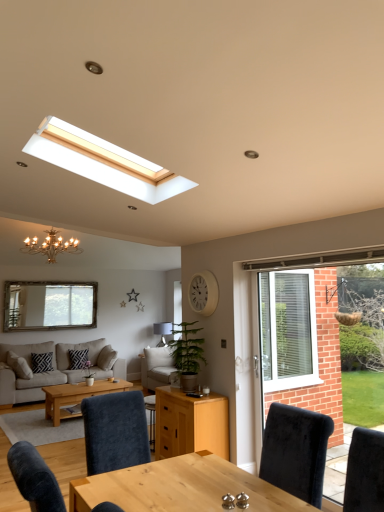
Question: From the image's perspective, is black textured pillow at center, the second pillow viewed from the left, beneath beige fabric couch at lower left?

Choices:
 (A) yes
 (B) no

Answer: (B)

Question: Would you consider black textured pillow at center, the second pillow viewed from the left, to be distant from beige fabric couch at lower left?

Choices:
 (A) yes
 (B) no

Answer: (B)

Question: Can you confirm if black textured pillow at center, acting as the 1th pillow starting from the right, is positioned to the left of beige fabric couch at lower left?

Choices:
 (A) no
 (B) yes

Answer: (A)

Question: Is black textured pillow at center, the second pillow viewed from the left, directly adjacent to beige fabric couch at lower left?

Choices:
 (A) yes
 (B) no

Answer: (B)

Question: Does black textured pillow at center, acting as the 1th pillow starting from the right, have a greater width compared to beige fabric couch at lower left?

Choices:
 (A) no
 (B) yes

Answer: (A)

Question: Is white matte clock at upper center in front of or behind light brown wooden coffee table at center in the image?

Choices:
 (A) behind
 (B) front

Answer: (B)

Question: From the image's perspective, is white matte clock at upper center positioned above or below light brown wooden coffee table at center?

Choices:
 (A) below
 (B) above

Answer: (B)

Question: From a real-world perspective, is white matte clock at upper center physically located above or below light brown wooden coffee table at center?

Choices:
 (A) above
 (B) below

Answer: (A)

Question: Does point (208, 307) appear closer or farther from the camera than point (71, 415)?

Choices:
 (A) closer
 (B) farther

Answer: (A)

Question: From their relative heights in the image, would you say white matte clock at upper center is taller or shorter than gold metallic chandelier at upper left?

Choices:
 (A) tall
 (B) short

Answer: (B)

Question: Considering their positions, is white matte clock at upper center located in front of or behind gold metallic chandelier at upper left?

Choices:
 (A) behind
 (B) front

Answer: (B)

Question: Choose the correct answer: Is white matte clock at upper center inside gold metallic chandelier at upper left or outside it?

Choices:
 (A) inside
 (B) outside

Answer: (B)

Question: Is point (213, 286) closer or farther from the camera than point (77, 241)?

Choices:
 (A) closer
 (B) farther

Answer: (A)

Question: From a real-world perspective, is white matte clock at upper center above or below black textured pillow at lower left, the second pillow viewed from the right?

Choices:
 (A) above
 (B) below

Answer: (A)

Question: From the image's perspective, is white matte clock at upper center above or below black textured pillow at lower left, the 1th pillow from the left?

Choices:
 (A) above
 (B) below

Answer: (A)